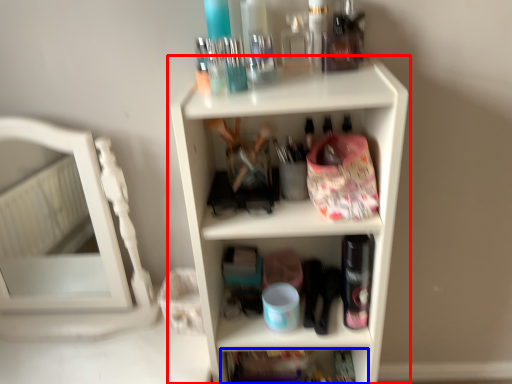
Question: Which object is closer to the camera taking this photo, shelf (highlighted by a red box) or shelf (highlighted by a blue box)?

Choices:
 (A) shelf
 (B) shelf

Answer: (A)